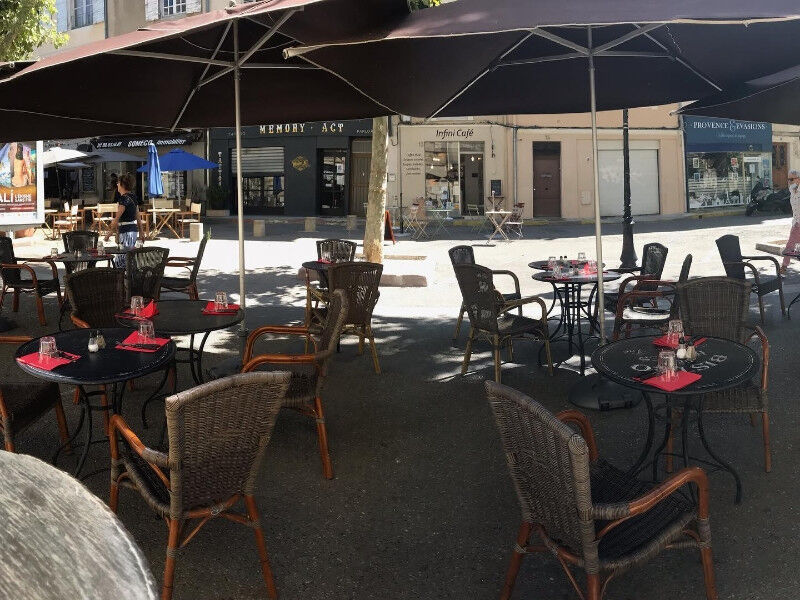
This screenshot has height=600, width=800. Find the location of `wicker back chair`. wicker back chair is located at coordinates (550, 491).